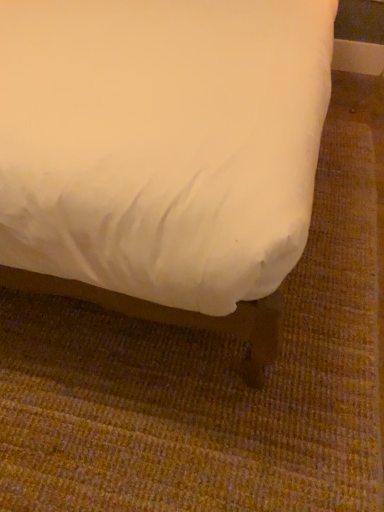
Measure the distance between white fabric bed at lower center and camera.

A distance of 30.34 inches exists between white fabric bed at lower center and camera.

The width and height of the screenshot is (384, 512). Describe the element at coordinates (162, 155) in the screenshot. I see `white fabric bed at lower center` at that location.

Measure the distance between point (55,258) and camera.

A distance of 93.80 centimeters exists between point (55,258) and camera.

Where is `white fabric bed at lower center`? Image resolution: width=384 pixels, height=512 pixels. white fabric bed at lower center is located at coordinates (162, 155).

Locate an element on the screen. The height and width of the screenshot is (512, 384). white fabric bed at lower center is located at coordinates (162, 155).